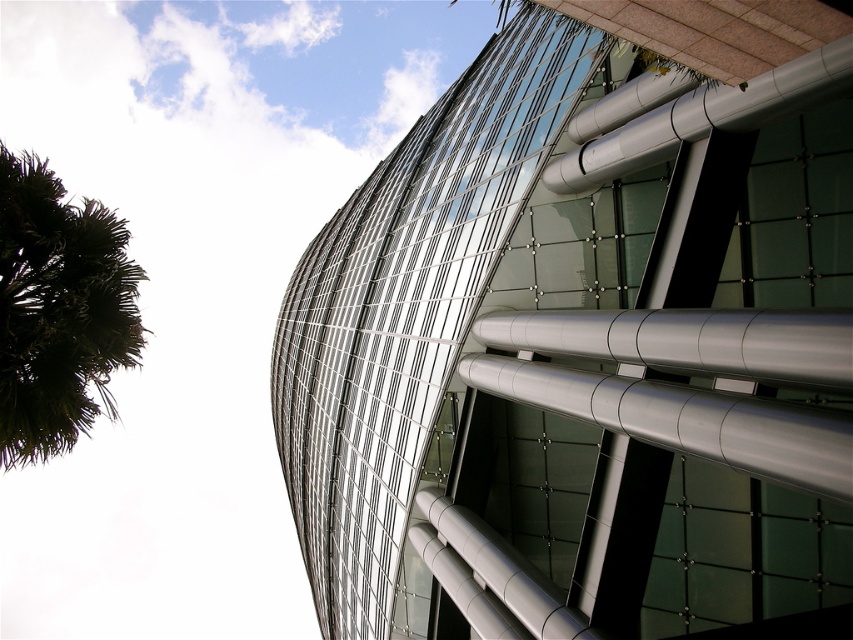
Question: Which of the following is the farthest from the observer?

Choices:
 (A) transparent glass building at upper center
 (B) green leafy palm tree at left

Answer: (B)

Question: Is transparent glass building at upper center further to the viewer compared to green leafy palm tree at left?

Choices:
 (A) yes
 (B) no

Answer: (B)

Question: Which point is farther to the camera?

Choices:
 (A) transparent glass building at upper center
 (B) green leafy palm tree at left

Answer: (B)

Question: Is transparent glass building at upper center to the left of green leafy palm tree at left from the viewer's perspective?

Choices:
 (A) yes
 (B) no

Answer: (B)

Question: Is transparent glass building at upper center in front of green leafy palm tree at left?

Choices:
 (A) yes
 (B) no

Answer: (A)

Question: Which of the following is the closest to the observer?

Choices:
 (A) green leafy palm tree at left
 (B) transparent glass building at upper center

Answer: (B)